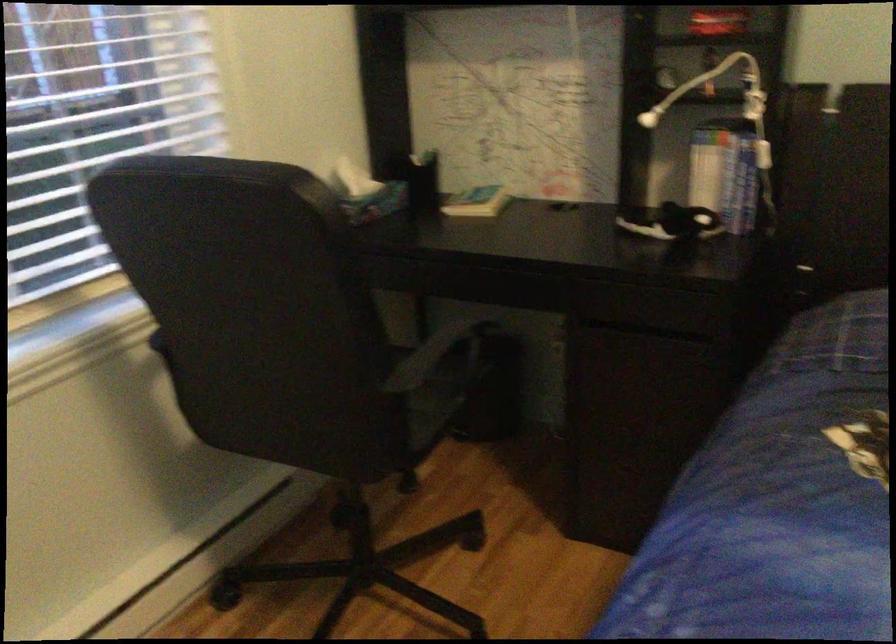
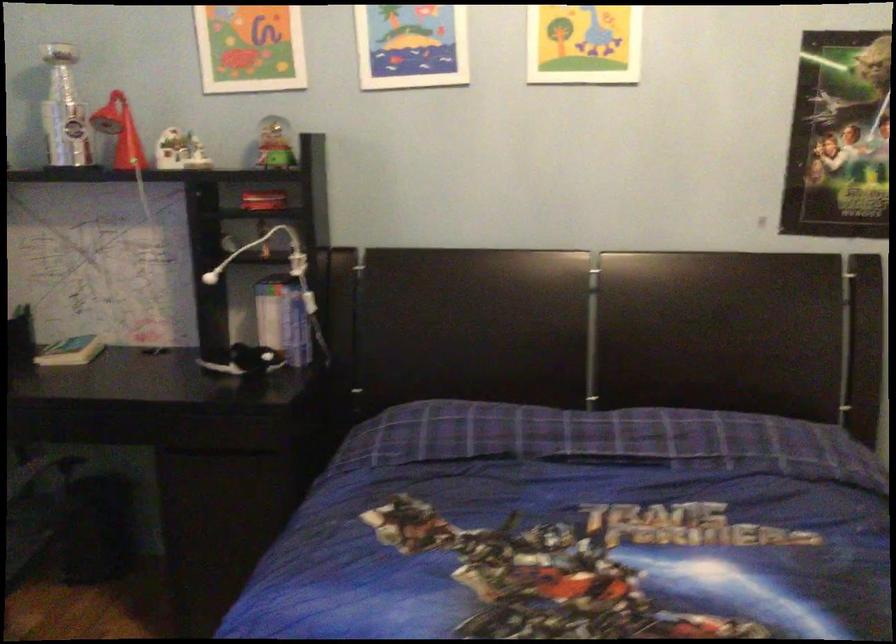
From the picture: The images are taken continuously from a first-person perspective. In which direction are you moving?

The cameraman walked toward right, backward.